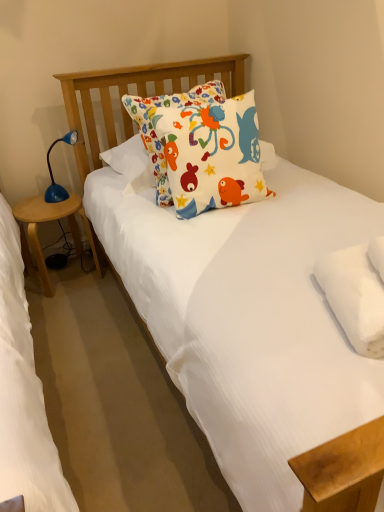
Question: In the image, is white fluffy pillow at upper right, the 1th pillow ordered from the bottom, positioned in front of or behind blue plastic table lamp at left?

Choices:
 (A) front
 (B) behind

Answer: (A)

Question: Which is correct: white fluffy pillow at upper right, the 1th pillow ordered from the bottom, is inside blue plastic table lamp at left, or outside of it?

Choices:
 (A) inside
 (B) outside

Answer: (B)

Question: Which of these objects is positioned farthest from the blue plastic table lamp at left?

Choices:
 (A) white fluffy pillow at upper right, the 1th pillow ordered from the bottom
 (B) white cotton pillow with colorful fish designs at center, positioned as the second pillow in right-to-left order
 (C) wooden side table at left

Answer: (A)

Question: Estimate the real-world distances between objects in this image. Which object is closer to the blue plastic table lamp at left?

Choices:
 (A) white fluffy pillow at upper right, acting as the second pillow starting from the top
 (B) white cotton pillow with colorful fish designs at center, acting as the 2th pillow starting from the bottom
 (C) wooden side table at left

Answer: (C)